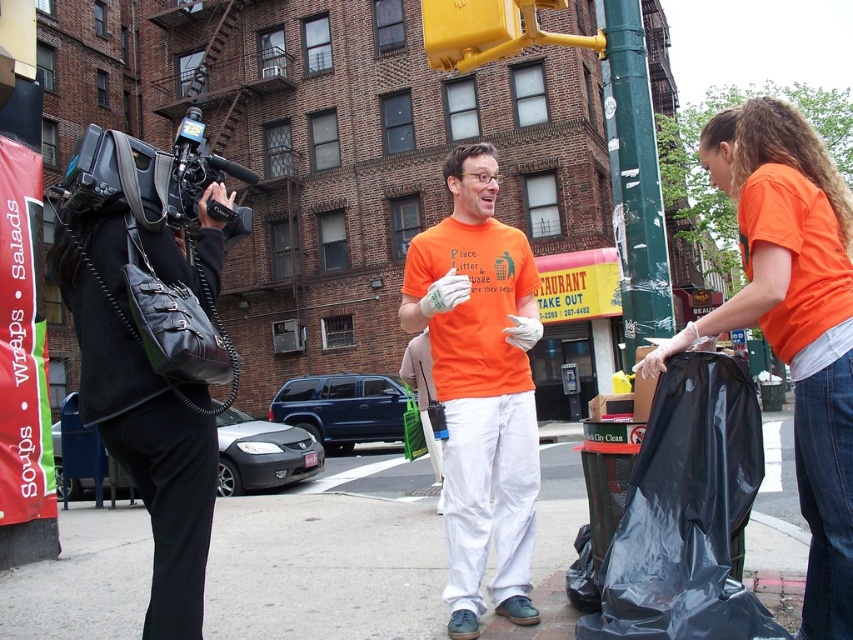
Looking at this image, is orange cotton shirt at center below black plastic bag at lower right?

No.

Is orange cotton shirt at center thinner than black plastic bag at lower right?

Indeed, orange cotton shirt at center has a lesser width compared to black plastic bag at lower right.

Find the location of a particular element. The height and width of the screenshot is (640, 853). orange cotton shirt at center is located at coordinates (480, 387).

Is orange cotton shirt at center further to camera compared to black plastic video camera at left?

Yes, it is behind black plastic video camera at left.

Who is positioned more to the right, orange cotton shirt at center or black plastic video camera at left?

orange cotton shirt at center

Locate an element on the screen. Image resolution: width=853 pixels, height=640 pixels. orange cotton shirt at center is located at coordinates (480, 387).

Where is `orange cotton shirt at center`? orange cotton shirt at center is located at coordinates (480, 387).

Describe the element at coordinates (793, 317) in the screenshot. I see `orange fabric shirt at center` at that location.

Does point (821, 164) come farther from viewer compared to point (115, 189)?

Yes, point (821, 164) is farther from viewer.

Is point (792, 320) closer to viewer compared to point (51, 188)?

That is True.

Locate an element on the screen. orange fabric shirt at center is located at coordinates (793, 317).